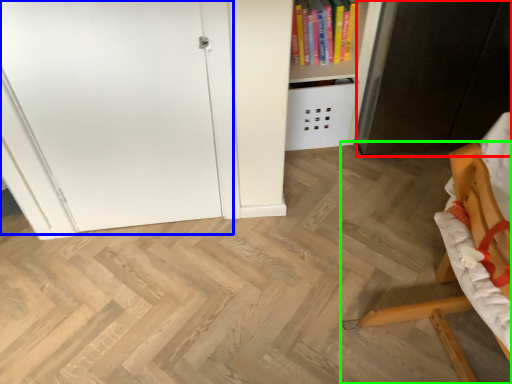
Question: Estimate the real-world distances between objects in this image. Which object is closer to cabinetry (highlighted by a red box), door (highlighted by a blue box) or furniture (highlighted by a green box)?

Choices:
 (A) door
 (B) furniture

Answer: (B)